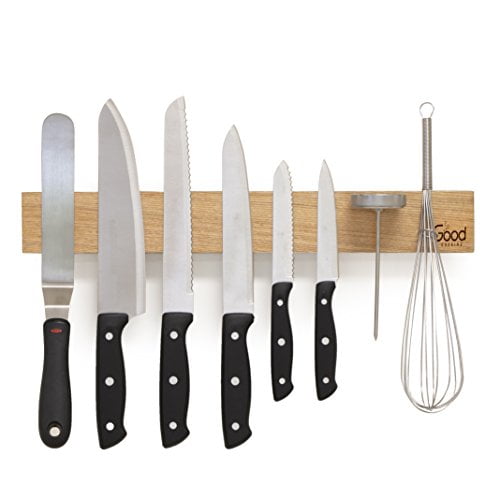
You are a GUI agent. You are given a task and a screenshot of the screen. Output one action in this format:
    pyautogui.click(x=<x>, y=<y>)
    Task: Click on the paring knife handle
    
    Given the screenshot: What is the action you would take?
    pyautogui.click(x=325, y=325)